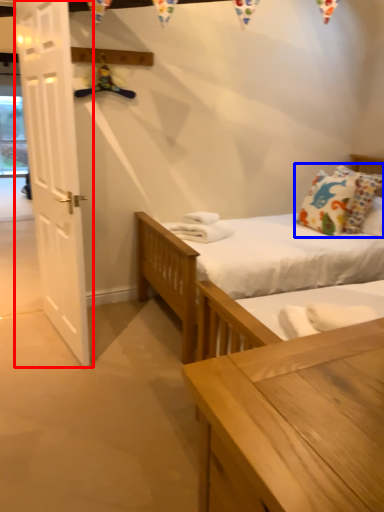
Question: Among these objects, which one is nearest to the camera, door (highlighted by a red box) or pillow (highlighted by a blue box)?

Choices:
 (A) door
 (B) pillow

Answer: (A)